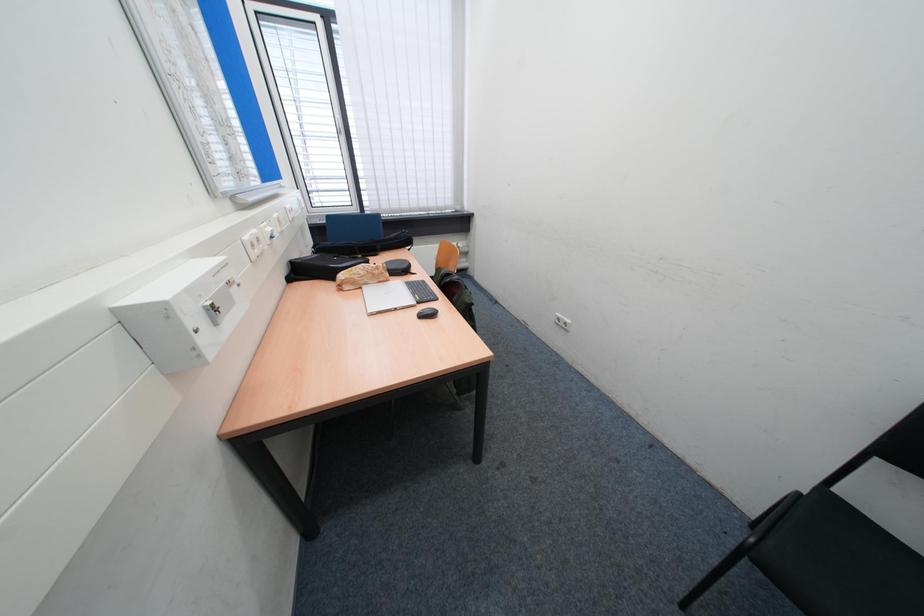
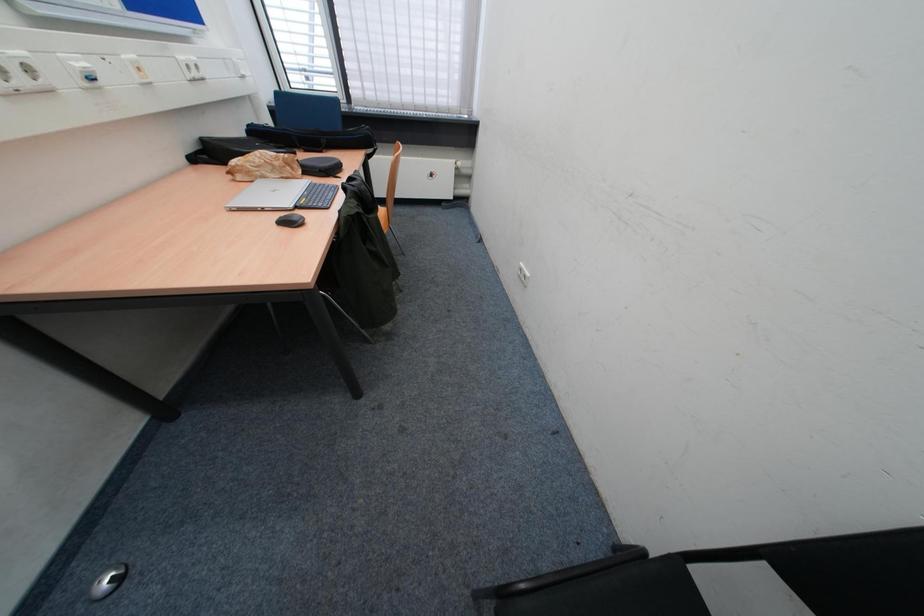
Question: The images are taken continuously from a first-person perspective. In which direction is your viewpoint rotating?

Choices:
 (A) Left
 (B) Right
 (C) Up
 (D) Down

Answer: (D)